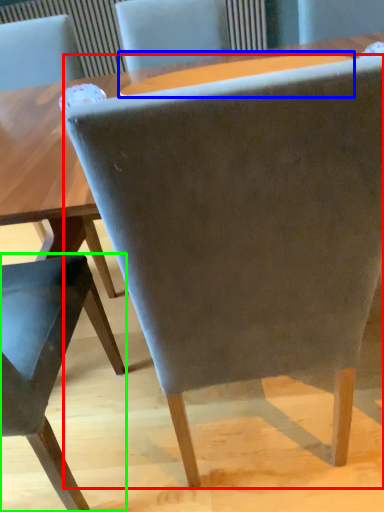
Question: Estimate the real-world distances between objects in this image. Which object is farther from chair (highlighted by a red box), round table (highlighted by a blue box) or chair (highlighted by a green box)?

Choices:
 (A) round table
 (B) chair

Answer: (A)